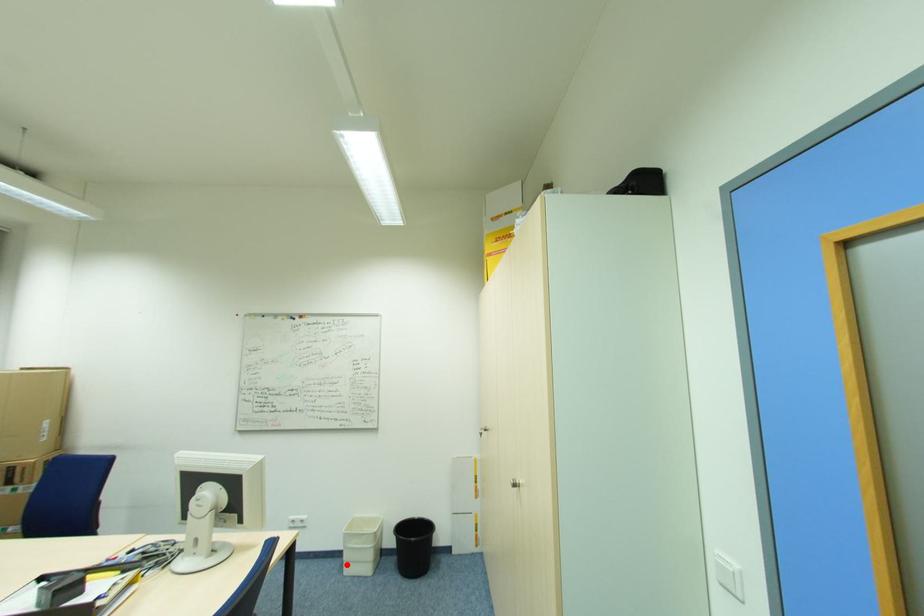
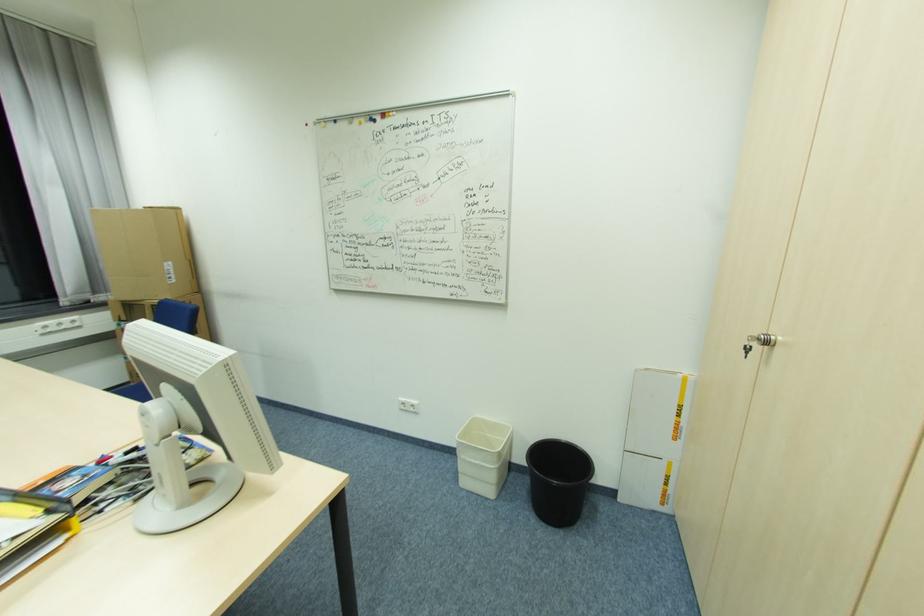
Locate, in the second image, the point that corresponds to the highlighted location in the first image.

(463, 475)